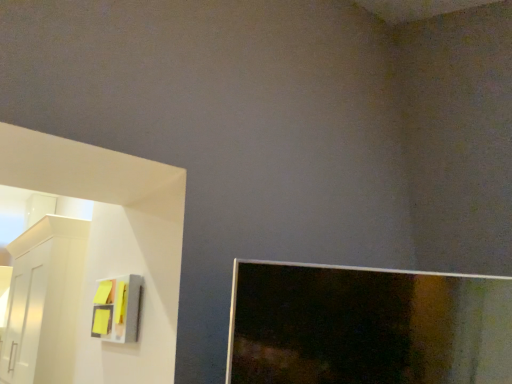
Question: From a real-world perspective, is yellow sticky notes at left positioned above or below white glossy cabinet at left?

Choices:
 (A) below
 (B) above

Answer: (A)

Question: Is yellow sticky notes at left taller or shorter than white glossy cabinet at left?

Choices:
 (A) short
 (B) tall

Answer: (A)

Question: Is yellow sticky notes at left wider or thinner than white glossy cabinet at left?

Choices:
 (A) wide
 (B) thin

Answer: (B)

Question: From the image's perspective, is white glossy cabinet at left located above or below yellow sticky notes at left?

Choices:
 (A) below
 (B) above

Answer: (A)

Question: Does point (53, 309) appear closer or farther from the camera than point (91, 332)?

Choices:
 (A) farther
 (B) closer

Answer: (A)

Question: Considering the relative positions of white glossy cabinet at left and yellow sticky notes at left in the image provided, is white glossy cabinet at left to the left or to the right of yellow sticky notes at left?

Choices:
 (A) right
 (B) left

Answer: (B)

Question: Looking at their shapes, would you say white glossy cabinet at left is wider or thinner than yellow sticky notes at left?

Choices:
 (A) wide
 (B) thin

Answer: (A)